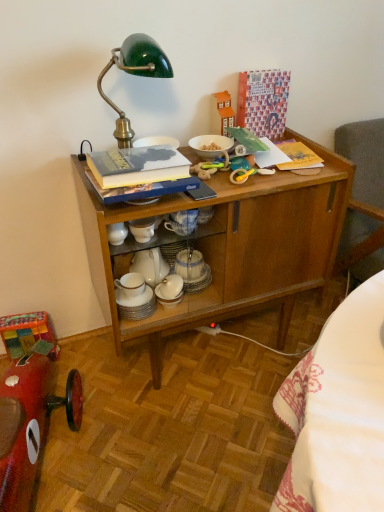
The image size is (384, 512). Identify the location of spots to the right of shiny red toy car at lower left. (167, 455).